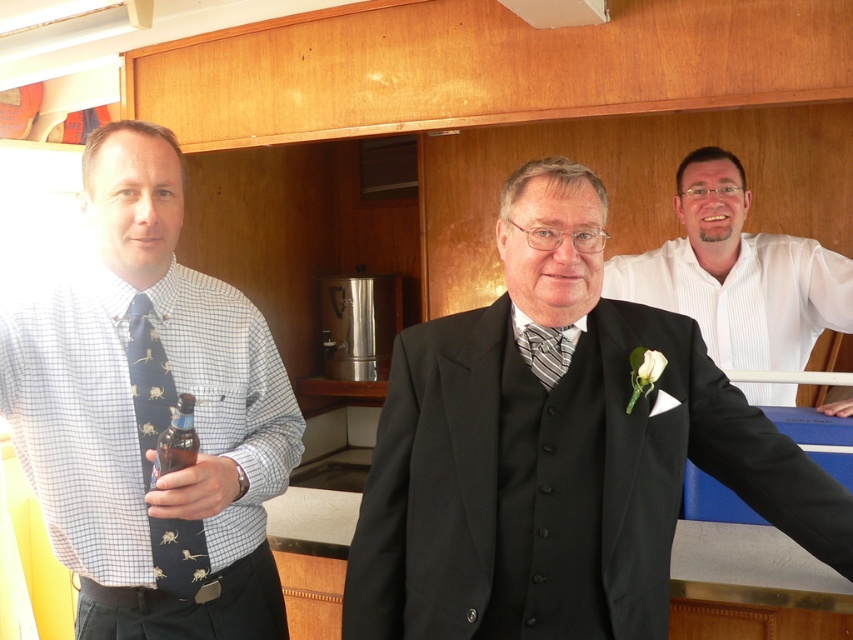
Question: Is white textured shirt at upper right above dark blue silk tie at left?

Choices:
 (A) no
 (B) yes

Answer: (B)

Question: Which object is the farthest from the striped fabric tie at center?

Choices:
 (A) white textured shirt at upper right
 (B) blue printed tie at left
 (C) dark blue silk tie at left
 (D) matte black suit at center

Answer: (A)

Question: Estimate the real-world distances between objects in this image. Which object is closer to the blue printed tie at left?

Choices:
 (A) matte black suit at center
 (B) white textured shirt at upper right
 (C) dark blue silk tie at left
 (D) striped fabric tie at center

Answer: (C)

Question: Is matte black suit at center bigger than striped fabric tie at center?

Choices:
 (A) no
 (B) yes

Answer: (B)

Question: Which object is positioned farthest from the white textured shirt at upper right?

Choices:
 (A) dark blue silk tie at left
 (B) striped fabric tie at center
 (C) blue printed tie at left

Answer: (A)

Question: Can you confirm if matte black suit at center is smaller than striped fabric tie at center?

Choices:
 (A) yes
 (B) no

Answer: (B)